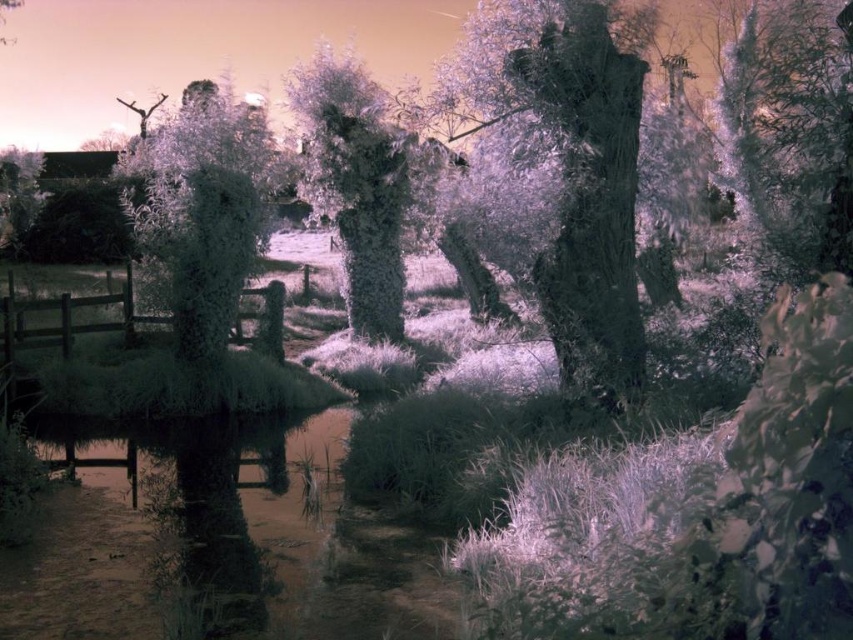
Can you confirm if frosted glass tree at upper left is positioned to the left of silvery textured tree at center?

Yes, frosted glass tree at upper left is to the left of silvery textured tree at center.

Consider the image. Who is lower down, frosted glass tree at upper left or silvery textured tree at center?

silvery textured tree at center is lower down.

Between point (175, 262) and point (350, 202), which one is positioned in front?

Point (175, 262)

Locate an element on the screen. The width and height of the screenshot is (853, 640). frosted glass tree at upper left is located at coordinates (209, 221).